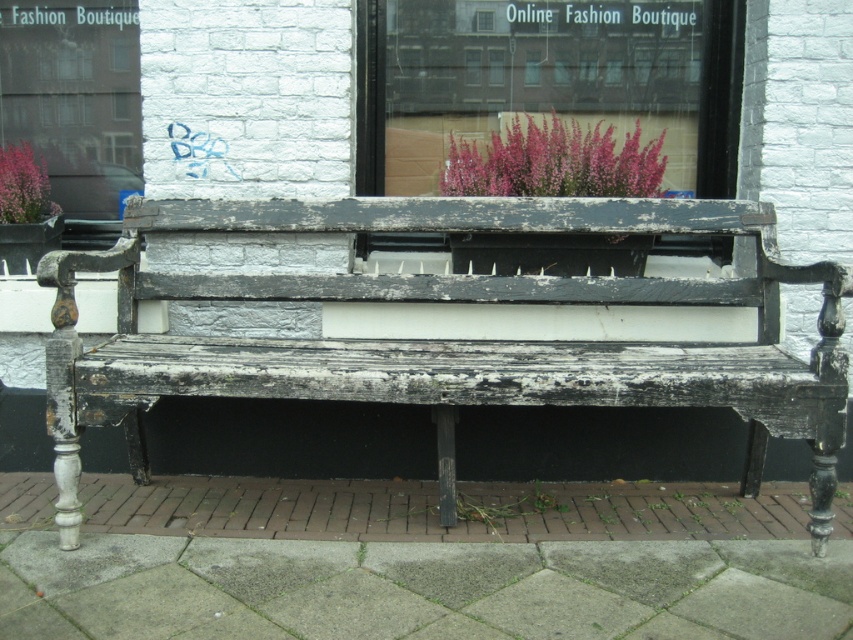
You are standing on the concrete paving at lower center and want to sit on the distressed wood bench at center. How many steps do you need to take to reach it?

The concrete paving at lower center is closer to the viewer than the distressed wood bench at center, so you need to take a few steps forward to reach the bench.

You are a gardener who wants to water the pink fluffy plant at upper center. You are standing on the concrete paving at lower center. Which direction should you move to reach the plant?

The concrete paving at lower center is located below the pink fluffy plant at upper center, so you should move upward to reach the plant.